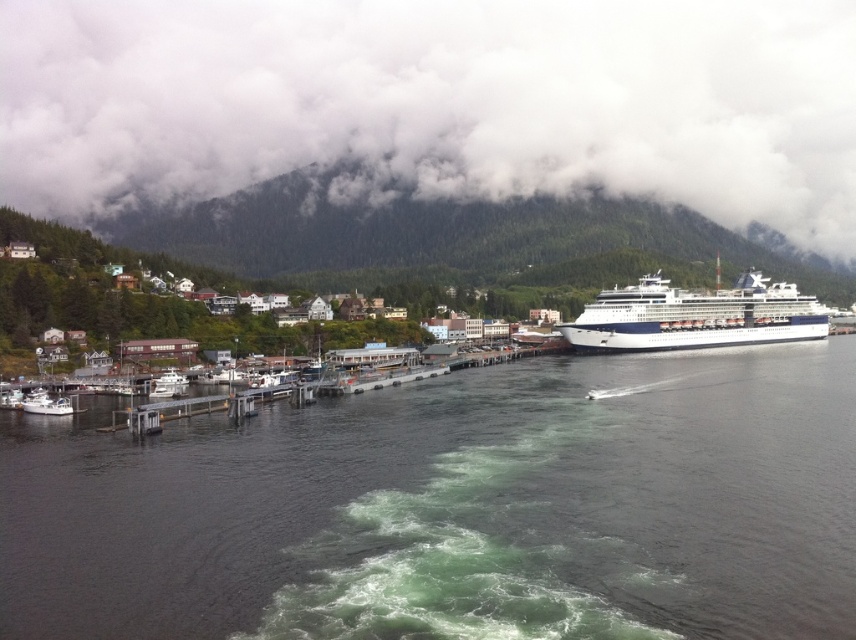
You are a photographer planning to take a landscape photo of the harbor scene. You want to ensure both the white fluffy cloud at upper center and the green forested mountain at upper center are in the same frame. Given that your camera has a 50mm lens, which has a field of view of approximately 46 degrees, can you estimate if both objects will fit within the frame?

The white fluffy cloud at upper center and green forested mountain at upper center are 84.83 meters apart. With a 50mm lens providing a 46 degree field of view, the distance between the two objects is within the lens capabilities, so both should fit in the frame.

You are a photographer planning to capture a wide shot of the harbor scene. You want to ensure both the wooden houses at left and the white matte boat at lower left are clearly visible in your photo. Based on their sizes, which object will appear bigger in the final image?

The wooden houses at left will appear bigger in the final image because they have a larger size compared to the white matte boat at lower left.

You are standing on the deck of the cruise ship and want to know how far the point at coordinates (415, 16) is from you. Can you determine the distance?

The point at coordinates (415, 16) is 543.24 meters away from you.